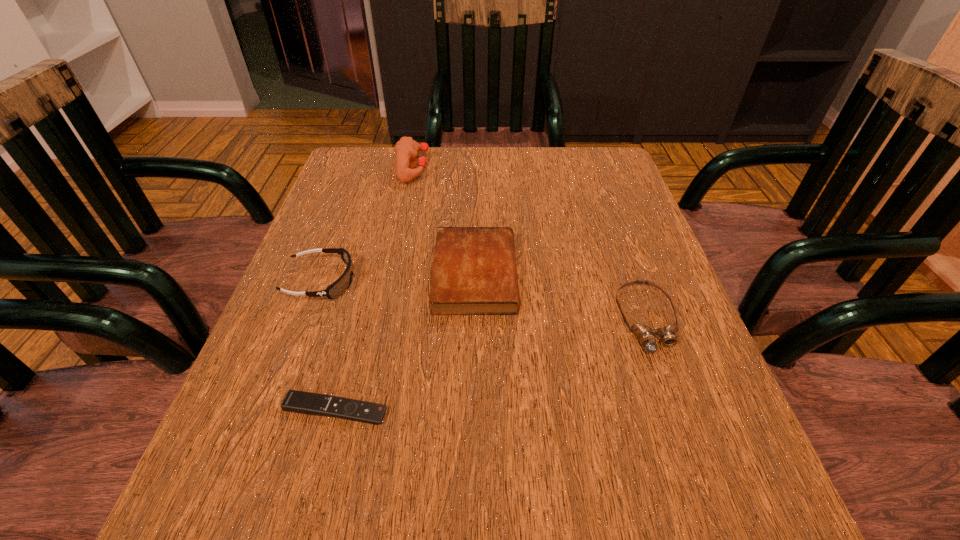
Find the location of a particular element. The image size is (960, 540). the farthest object is located at coordinates (406, 149).

Where is `the tallest object`? the tallest object is located at coordinates coord(406,149).

The height and width of the screenshot is (540, 960). Identify the location of the taller goggles. (342, 284).

The width and height of the screenshot is (960, 540). Identify the location of the fourth shortest object. (342, 284).

Where is `Bible`? This screenshot has width=960, height=540. Bible is located at coordinates point(474,272).

Locate an element on the screen. The image size is (960, 540). the fourth object from left to right is located at coordinates (474, 272).

Locate an element on the screen. This screenshot has height=540, width=960. the shorter goggles is located at coordinates (646, 334).

Locate an element on the screen. the second shortest object is located at coordinates (646, 334).

This screenshot has width=960, height=540. In order to click on remote control in this screenshot , I will do `click(295, 401)`.

Identify the location of the shortest object. This screenshot has width=960, height=540. (295, 401).